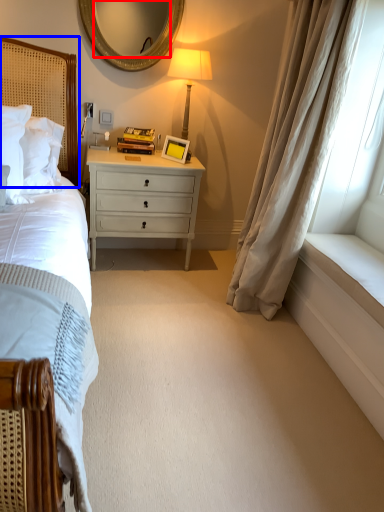
Question: Which point is further to the camera, mirror (highlighted by a red box) or headboard (highlighted by a blue box)?

Choices:
 (A) mirror
 (B) headboard

Answer: (A)